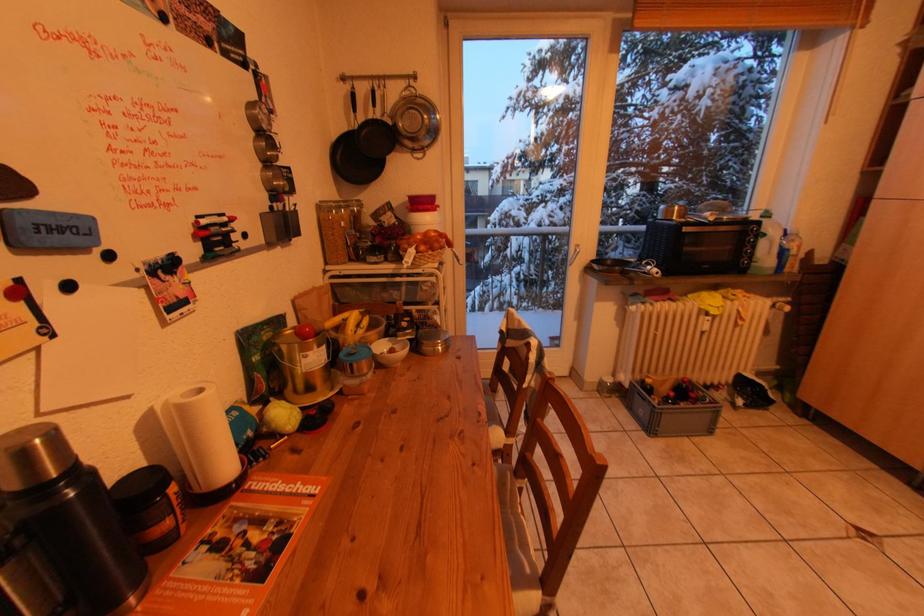
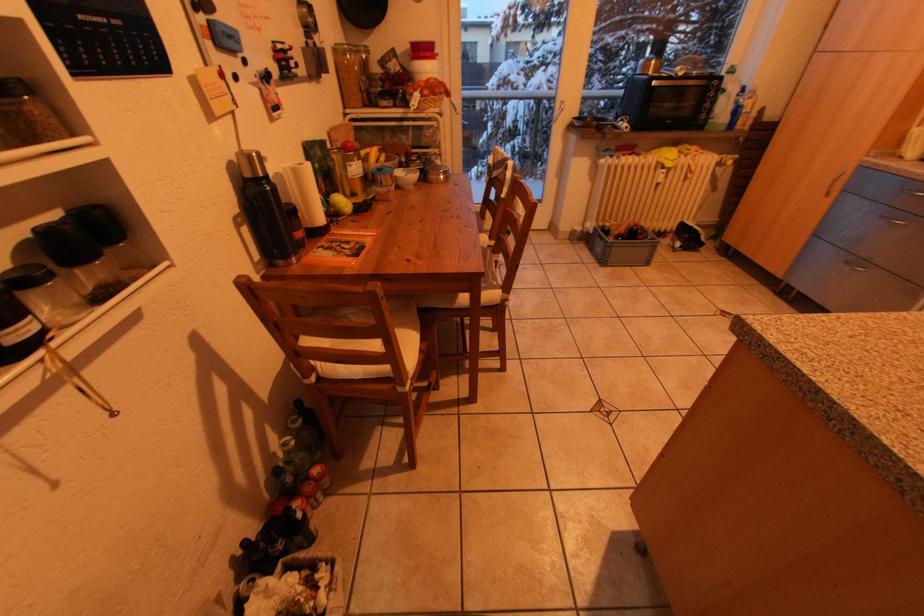
Question: In a continuous first-person perspective shot, in which direction is the camera moving?

Choices:
 (A) Left
 (B) Right
 (C) Forward
 (D) Backward

Answer: (D)